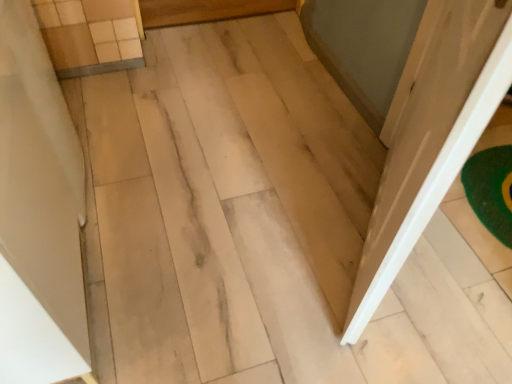
Identify the location of vacant region to the left of white wood door at right. (240, 228).